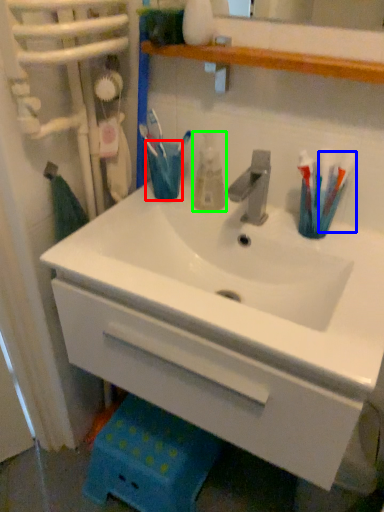
Question: Which is farther away from turquoise (highlighted by a red box)? toothbrush (highlighted by a blue box) or mouthwash (highlighted by a green box)?

Choices:
 (A) toothbrush
 (B) mouthwash

Answer: (A)